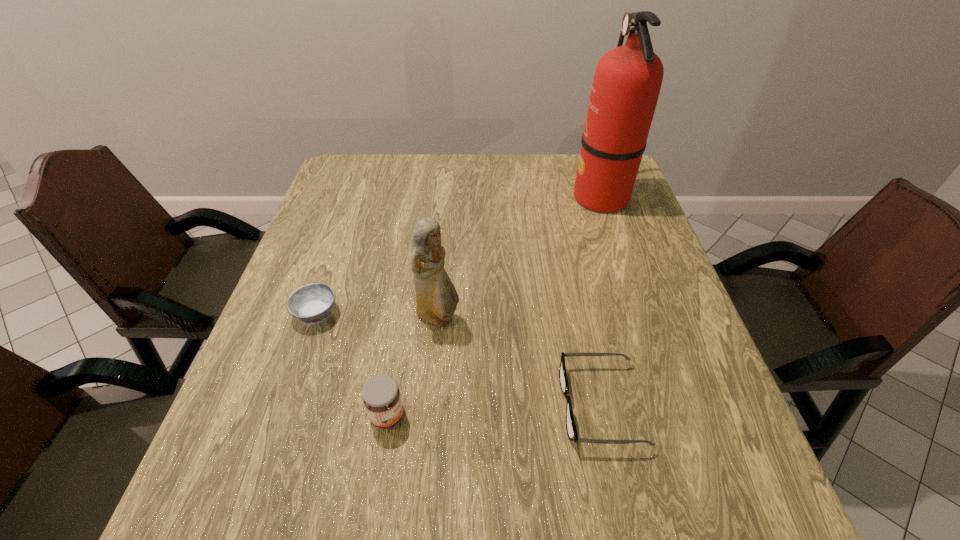
Find the location of a particular element. This screenshot has height=540, width=960. the farthest object is located at coordinates (627, 81).

Where is `the tallest object`? The image size is (960, 540). the tallest object is located at coordinates (627, 81).

Locate an element on the screen. The height and width of the screenshot is (540, 960). the fourth shortest object is located at coordinates (436, 297).

What are the coordinates of `jam` in the screenshot? It's located at (381, 395).

The width and height of the screenshot is (960, 540). Identify the location of spectacles. click(x=570, y=424).

Image resolution: width=960 pixels, height=540 pixels. I want to click on the leftmost object, so click(x=312, y=303).

The width and height of the screenshot is (960, 540). I want to click on vacant area located 0.390m on the side of the tallest object with the nozzle and handle, so click(x=438, y=197).

Find the location of a particular element. The width and height of the screenshot is (960, 540). vacant region located on the side of the tallest object with the nozzle and handle is located at coordinates (479, 197).

This screenshot has height=540, width=960. What are the coordinates of `vacant space located on the side of the tallest object with the nozzle and handle` in the screenshot? It's located at (x=472, y=197).

This screenshot has height=540, width=960. What are the coordinates of `free space located on the front-facing side of the second tallest object` in the screenshot? It's located at (585, 318).